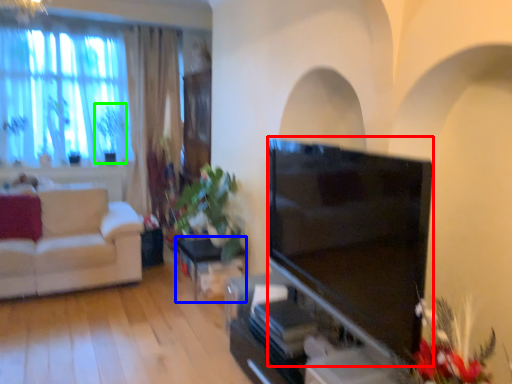
Question: Considering the real-world distances, which object is closest to television (highlighted by a red box)? table (highlighted by a blue box) or plant (highlighted by a green box).

Choices:
 (A) table
 (B) plant

Answer: (A)